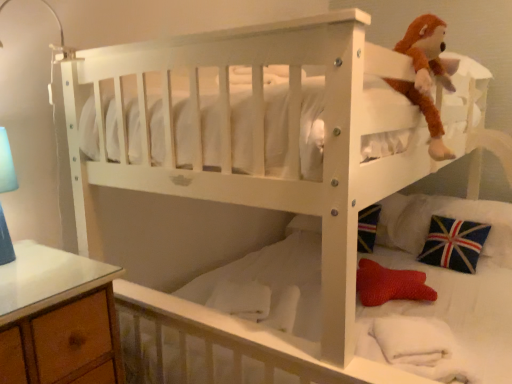
Question: Could union jack fabric pillow at lower right be considered to be inside brown plush toy at upper right?

Choices:
 (A) yes
 (B) no

Answer: (B)

Question: From a real-world perspective, is brown plush toy at upper right located higher than union jack fabric pillow at lower right?

Choices:
 (A) no
 (B) yes

Answer: (B)

Question: Can you confirm if brown plush toy at upper right is wider than union jack fabric pillow at lower right?

Choices:
 (A) no
 (B) yes

Answer: (A)

Question: Could you tell me if brown plush toy at upper right is turned towards union jack fabric pillow at lower right?

Choices:
 (A) yes
 (B) no

Answer: (B)

Question: Considering the relative sizes of brown plush toy at upper right and union jack fabric pillow at lower right in the image provided, is brown plush toy at upper right thinner than union jack fabric pillow at lower right?

Choices:
 (A) yes
 (B) no

Answer: (A)

Question: Is brown plush toy at upper right positioned behind union jack fabric pillow at lower right?

Choices:
 (A) yes
 (B) no

Answer: (B)

Question: Is union jack fabric pillow at lower right outside of brown plush toy at upper right?

Choices:
 (A) no
 (B) yes

Answer: (B)

Question: From the image's perspective, is union jack fabric pillow at lower right located above brown plush toy at upper right?

Choices:
 (A) no
 (B) yes

Answer: (A)

Question: Can you confirm if union jack fabric pillow at lower right is bigger than brown plush toy at upper right?

Choices:
 (A) yes
 (B) no

Answer: (A)

Question: From a real-world perspective, is union jack fabric pillow at lower right on top of brown plush toy at upper right?

Choices:
 (A) yes
 (B) no

Answer: (B)

Question: Does union jack fabric pillow at lower right have a lesser height compared to brown plush toy at upper right?

Choices:
 (A) yes
 (B) no

Answer: (A)

Question: Is union jack fabric pillow at lower right looking in the opposite direction of brown plush toy at upper right?

Choices:
 (A) no
 (B) yes

Answer: (A)

Question: Considering the relative positions of brown plush toy at upper right and union jack fabric pillow at lower right in the image provided, is brown plush toy at upper right to the left or to the right of union jack fabric pillow at lower right?

Choices:
 (A) right
 (B) left

Answer: (B)